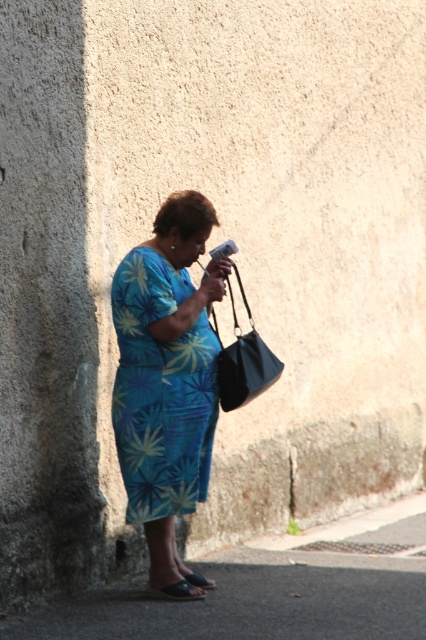
You are an interior designer analyzing the placement of objects in this image. The blue floral fabric dress at center is located at coordinates 0.611 on the x axis and 0.378 on the y axis. If you were to place a decorative mirror on the wall behind the dress, where should you position it so that it reflects the dress perfectly? Please provide coordinates in the same format as the dress.

To perfectly reflect the blue floral fabric dress at center, the decorative mirror should be placed at coordinates approximately 0.611 on the x axis and 0.378 on the y axis, directly behind the dress.

You are a photographer setting up a shoot. You notice two sandals at the lower center of the image. Which sandal is closer to the camera, the brown leather sandal at lower center or the black fabric sandal at lower center?

The brown leather sandal at lower center is closer to the camera because it is in front of the black fabric sandal at lower center.